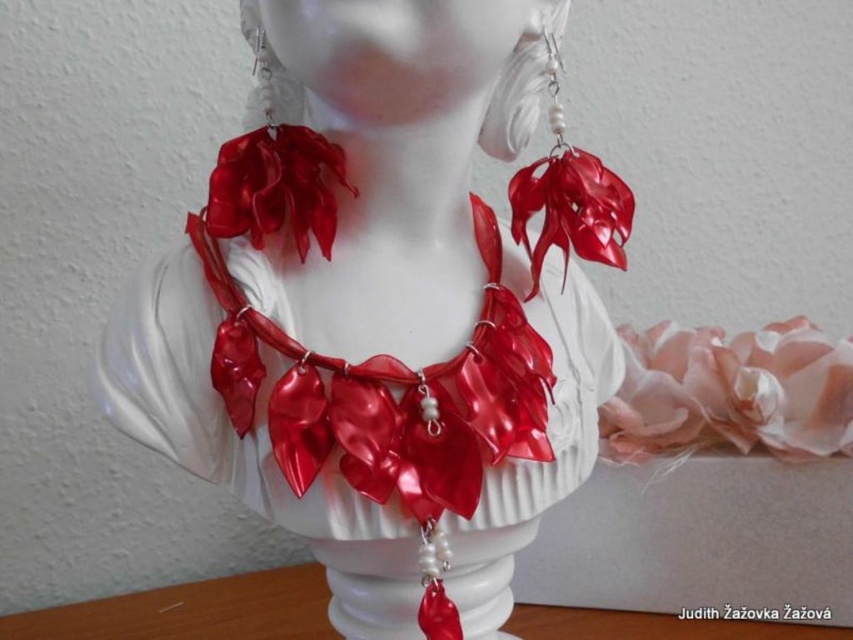
You are an art conservator examining the bust and its jewelry. You notice two points on the jewelry, one at point [703,436] and another at point [323,224]. Which point is closer to your eyes?

Point [703,436] is further to the viewer than point [323,224], so the point at [323,224] is closer to your eyes.

You are an art curator examining the bust and notice the pink satin flower at center and the glossy plastic necklace at center. Which object is closer to the viewer?

The pink satin flower at center is closer to the viewer than the glossy plastic necklace at center because the glossy plastic necklace at center is behind the pink satin flower at center.

You are an art conservator working on restoring the bust. You need to place a protective barrier between the pink satin flower at center and the shiny red ribbon at center. If the barrier must be at least 20 inches wide to cover the space between them, will it fit?

The distance between the pink satin flower at center and the shiny red ribbon at center is 23.23 inches. Since the barrier needs to be at least 20 inches wide, it will fit as the required width is less than the available space.